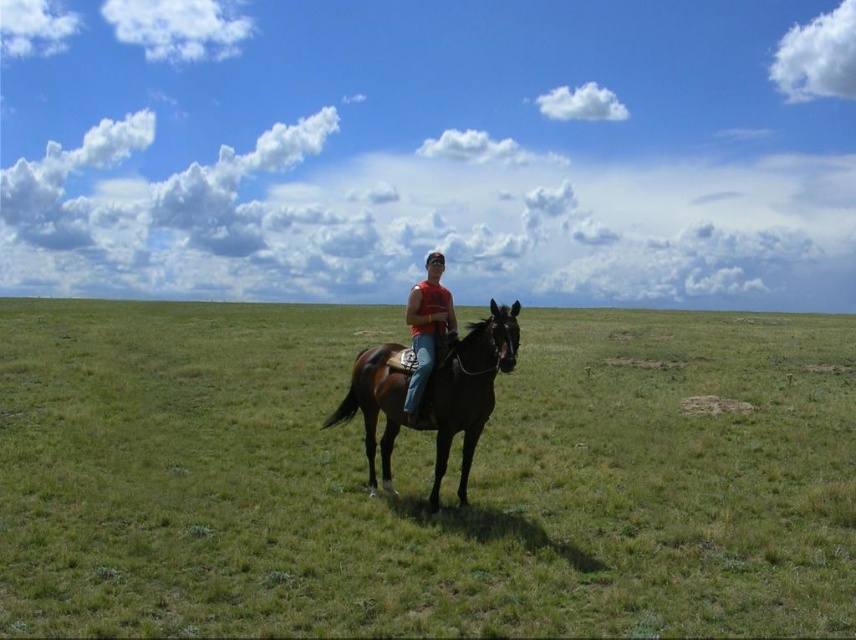
You are a photographer planning to take a portrait of the rider wearing the matte red tank top at center while capturing the green grassy field at center in the background. Given that your camera has a depth of field that can sharply focus on objects within 10 meters, will both the rider and the background be in focus simultaneously?

The distance between the green grassy field at center and the matte red tank top at center is 14.12 meters. Since the depth of field can only focus within 10 meters, the rider and the background cannot both be in focus at the same time.

You are a photographer trying to capture a closeup shot of the shiny brown horse at center and the matte red tank top at center. What is the minimum distance you need to be from the subjects to ensure both are in frame?

The minimum distance required is 32.21 inches because the shiny brown horse at center and the matte red tank top at center are 32.21 inches apart from each other.

You are standing at the origin point in the image. Where is the green grassy field at center located?

The green grassy field at center is located at point 0.748 on the x axis and 0.494 on the y axis.